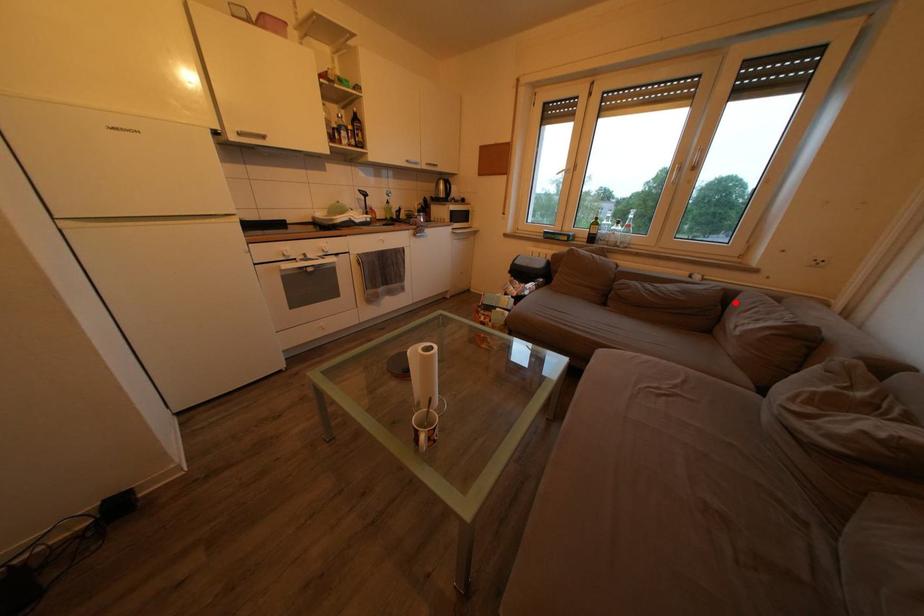
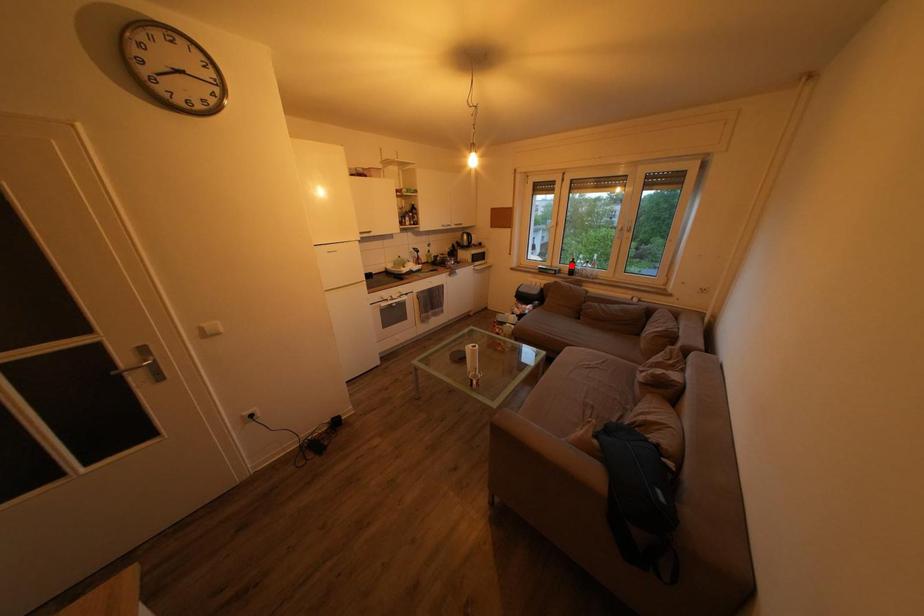
I am providing you with two images of the same scene from different viewpoints. A red point is marked on the first image and another point is marked on the second image. Do the highlighted points in image1 and image2 indicate the same real-world spot?

No